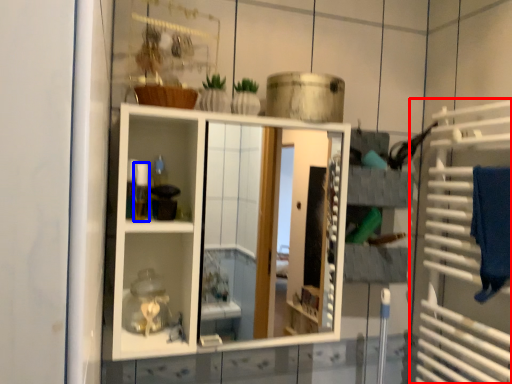
Question: Which of the following is the closest to the observer, cage (highlighted by a red box) or toiletry (highlighted by a blue box)?

Choices:
 (A) cage
 (B) toiletry

Answer: (A)